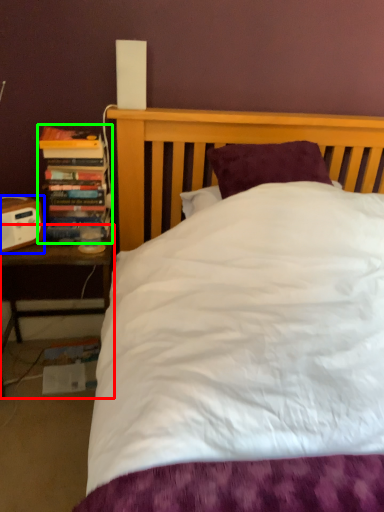
Question: Which is nearer to the nightstand (highlighted by a red box)? speaker (highlighted by a blue box) or book (highlighted by a green box).

Choices:
 (A) speaker
 (B) book

Answer: (A)